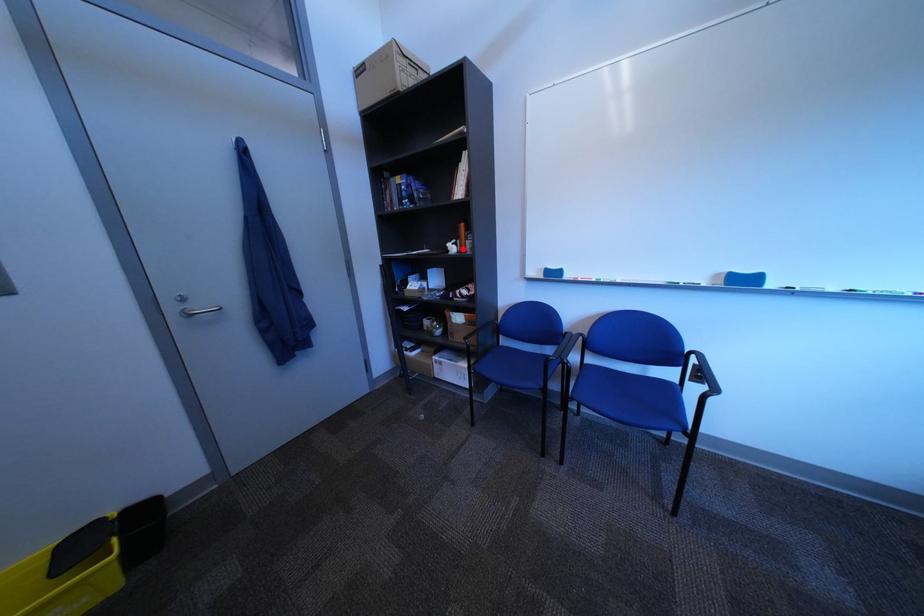
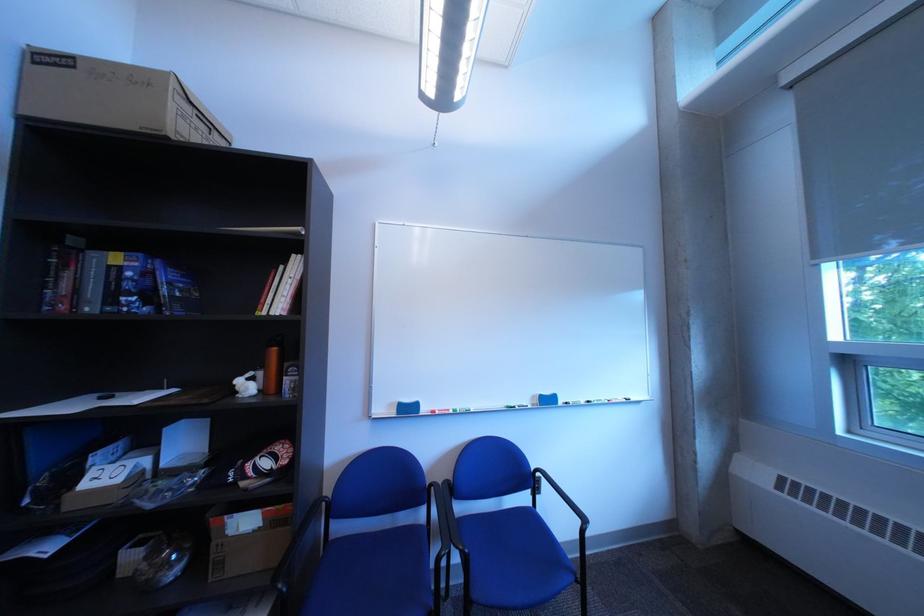
Find the pixel in the second image that matches the highlighted location in the first image.

(249, 387)